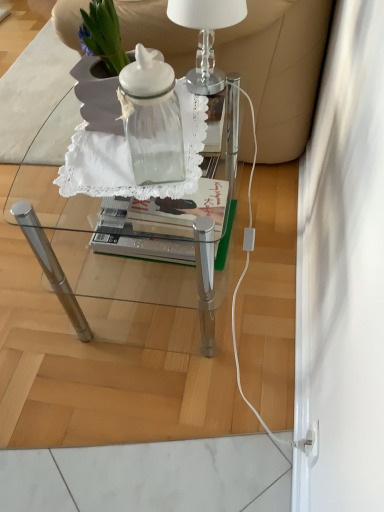
Question: Is clear glass table lamp at upper center taller than transparent glass jar at center?

Choices:
 (A) no
 (B) yes

Answer: (A)

Question: Would you say clear glass table lamp at upper center contains transparent glass jar at center?

Choices:
 (A) yes
 (B) no

Answer: (B)

Question: Is clear glass table lamp at upper center looking in the opposite direction of transparent glass jar at center?

Choices:
 (A) no
 (B) yes

Answer: (A)

Question: Does clear glass table lamp at upper center have a lesser width compared to transparent glass jar at center?

Choices:
 (A) yes
 (B) no

Answer: (B)

Question: Is clear glass table lamp at upper center to the right of transparent glass jar at center from the viewer's perspective?

Choices:
 (A) no
 (B) yes

Answer: (B)

Question: Is clear glass table lamp at upper center wider or thinner than transparent glass table at center?

Choices:
 (A) thin
 (B) wide

Answer: (A)

Question: From their relative heights in the image, would you say clear glass table lamp at upper center is taller or shorter than transparent glass table at center?

Choices:
 (A) tall
 (B) short

Answer: (B)

Question: Considering the positions of clear glass table lamp at upper center and transparent glass table at center in the image, is clear glass table lamp at upper center bigger or smaller than transparent glass table at center?

Choices:
 (A) big
 (B) small

Answer: (B)

Question: Considering the positions of point (230, 10) and point (97, 295), is point (230, 10) closer or farther from the camera than point (97, 295)?

Choices:
 (A) closer
 (B) farther

Answer: (A)

Question: In terms of size, does white leather armchair at upper center appear bigger or smaller than clear glass table lamp at upper center?

Choices:
 (A) big
 (B) small

Answer: (A)

Question: In the image, is white leather armchair at upper center positioned in front of or behind clear glass table lamp at upper center?

Choices:
 (A) front
 (B) behind

Answer: (B)

Question: Choose the correct answer: Is white leather armchair at upper center inside clear glass table lamp at upper center or outside it?

Choices:
 (A) inside
 (B) outside

Answer: (B)

Question: Considering the positions of point (251, 38) and point (228, 7), is point (251, 38) closer or farther from the camera than point (228, 7)?

Choices:
 (A) farther
 (B) closer

Answer: (A)

Question: Looking at the image, does transparent glass table at center seem bigger or smaller compared to transparent glass jar at center?

Choices:
 (A) small
 (B) big

Answer: (B)

Question: Would you say transparent glass table at center is inside or outside transparent glass jar at center?

Choices:
 (A) inside
 (B) outside

Answer: (B)